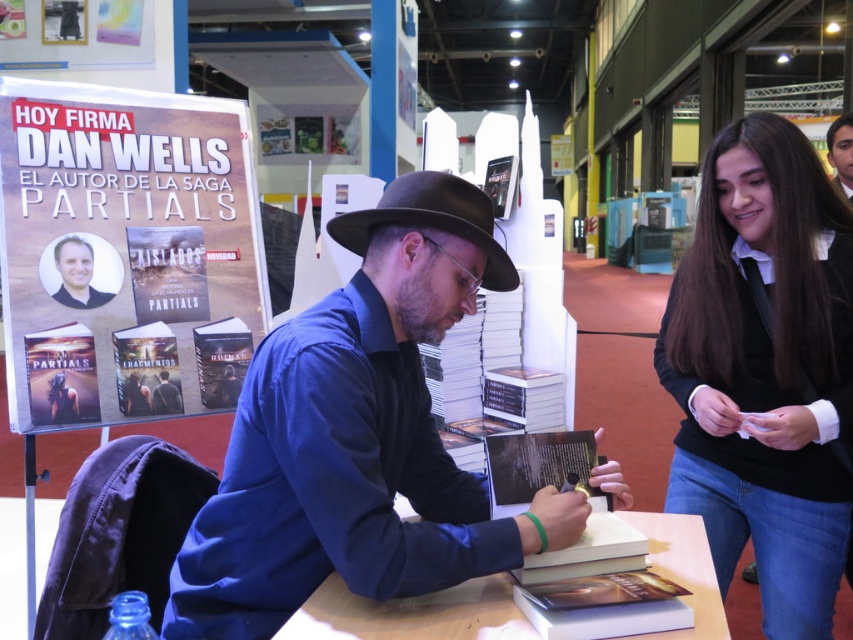
Is blue matte shirt at center bigger than wooden signboard at upper left?

No.

In the scene shown: Measure the distance between blue matte shirt at center and wooden signboard at upper left.

blue matte shirt at center is 37.81 inches from wooden signboard at upper left.

Looking at this image, who is more forward, (x=305, y=394) or (x=201, y=304)?

Point (x=305, y=394) is more forward.

The image size is (853, 640). Identify the location of blue matte shirt at center. (358, 435).

At what (x,y) coordinates should I click in order to perform the action: click on black felt fedora at center. Please return your answer as a coordinate pair (x, y). This screenshot has height=640, width=853. Looking at the image, I should click on (431, 220).

Who is shorter, black felt fedora at center or smooth skin face at upper right?

With less height is black felt fedora at center.

Is point (363, 252) closer to viewer compared to point (836, 147)?

That is True.

Find the location of `black felt fedora at center`. black felt fedora at center is located at coordinates (431, 220).

Is wooden table at center positioned before smooth skin face at upper right?

Yes.

Does wooden table at center appear under smooth skin face at upper right?

Correct, wooden table at center is located below smooth skin face at upper right.

This screenshot has width=853, height=640. Identify the location of wooden table at center. (404, 612).